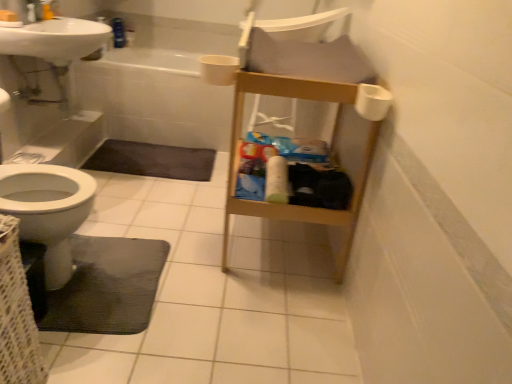
I want to click on free area below black rubber bath mat at lower left, which is the 2th bath mat in back-to-front order (from a real-world perspective), so click(126, 277).